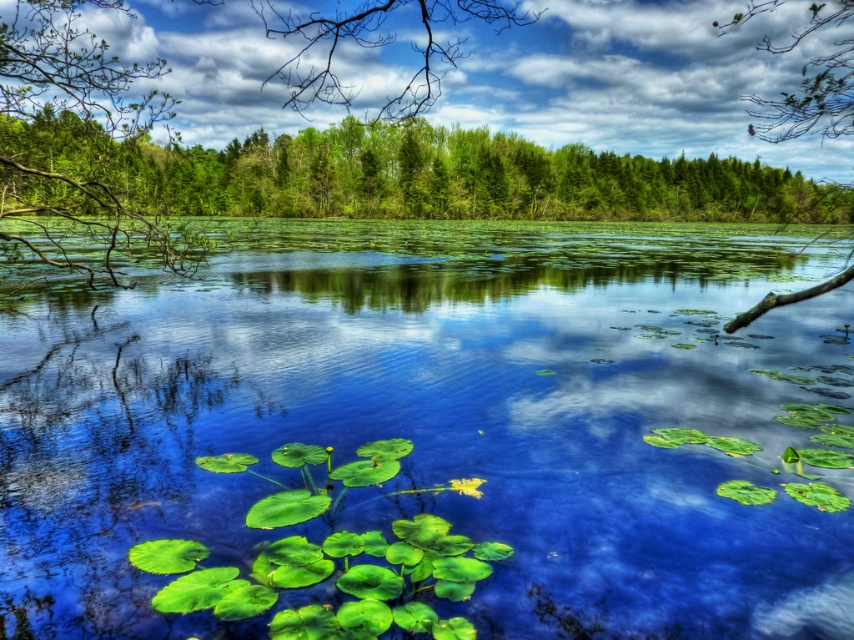
Question: Is green glossy lily pads at center below smooth bark branch at right?

Choices:
 (A) yes
 (B) no

Answer: (A)

Question: Which point is closer to the camera taking this photo?

Choices:
 (A) (82, 195)
 (B) (138, 189)
 (C) (841, 65)

Answer: (A)

Question: Can you confirm if green glossy lily pads at center is positioned to the left of green leafy tree at upper center?

Choices:
 (A) yes
 (B) no

Answer: (A)

Question: Which is farther from the green leafy tree at upper center?

Choices:
 (A) green leafy branch at upper left
 (B) smooth bark branch at right
 (C) green glossy lily pads at center

Answer: (A)

Question: Among these points, which one is nearest to the camera?

Choices:
 (A) (733, 19)
 (B) (164, 168)
 (C) (264, 292)

Answer: (A)

Question: Can you confirm if green leafy tree at upper center is wider than green leafy branch at upper left?

Choices:
 (A) no
 (B) yes

Answer: (B)